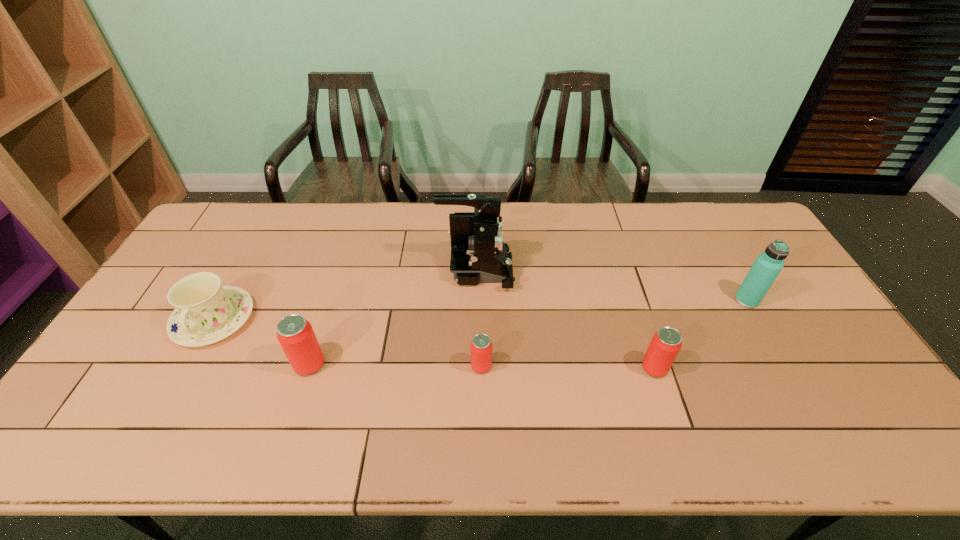
Locate an element on the screen. The height and width of the screenshot is (540, 960). the fourth shortest object is located at coordinates (295, 334).

Where is `the leftmost beer can`? This screenshot has height=540, width=960. the leftmost beer can is located at coordinates (295, 334).

Find the location of a particular element. This screenshot has width=960, height=540. the shortest object is located at coordinates tap(481, 346).

At what (x,y) coordinates should I click in order to perform the action: click on the second beer can from right to left. Please return your answer as a coordinate pair (x, y). Looking at the image, I should click on (481, 346).

Find the location of a particular element. Image resolution: width=960 pixels, height=540 pixels. the second shortest beer can is located at coordinates (666, 343).

At what (x,y) coordinates should I click in order to perform the action: click on the rightmost beer can. Please return your answer as a coordinate pair (x, y). Image resolution: width=960 pixels, height=540 pixels. Looking at the image, I should click on (666, 343).

Locate an element on the screen. The width and height of the screenshot is (960, 540). the leftmost object is located at coordinates (206, 312).

The image size is (960, 540). I want to click on camcorder, so click(478, 254).

The height and width of the screenshot is (540, 960). Identify the location of the rightmost object. (767, 266).

I want to click on the fifth shortest object, so click(767, 266).